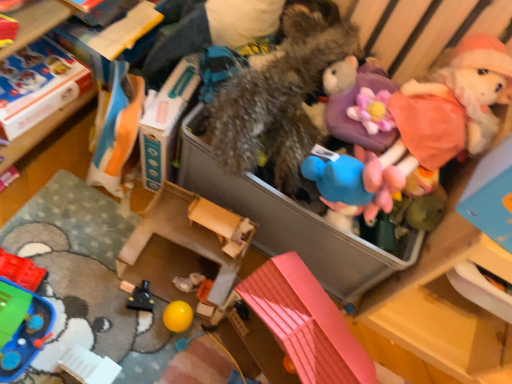
Question: Does orange fabric bag at upper left, the 3th toy viewed from the left, contain translucent plastic bricks at lower left, which is counted as the first toy, starting from the left?

Choices:
 (A) no
 (B) yes

Answer: (A)

Question: Is orange fabric bag at upper left, the 3th toy viewed from the left, thinner than translucent plastic bricks at lower left, which is counted as the first toy, starting from the left?

Choices:
 (A) no
 (B) yes

Answer: (A)

Question: Are orange fabric bag at upper left, the 3th toy viewed from the left, and translucent plastic bricks at lower left, which is counted as the first toy, starting from the left, beside each other?

Choices:
 (A) yes
 (B) no

Answer: (B)

Question: From a real-world perspective, is orange fabric bag at upper left, the 3th toy viewed from the left, over translucent plastic bricks at lower left, which is counted as the first toy, starting from the left?

Choices:
 (A) yes
 (B) no

Answer: (A)

Question: Is orange fabric bag at upper left, acting as the 6th toy starting from the right, to the right of translucent plastic bricks at lower left, which is counted as the first toy, starting from the left, from the viewer's perspective?

Choices:
 (A) yes
 (B) no

Answer: (A)

Question: In terms of width, does fuzzy fabric stuffed animal at center, positioned as the 4th toy in right-to-left order, look wider or thinner when compared to black plastic toy at lower left, acting as the fourth toy starting from the left?

Choices:
 (A) thin
 (B) wide

Answer: (B)

Question: From the image's perspective, is fuzzy fabric stuffed animal at center, positioned as the 4th toy in right-to-left order, above or below black plastic toy at lower left, acting as the fourth toy starting from the left?

Choices:
 (A) above
 (B) below

Answer: (A)

Question: From a real-world perspective, relative to black plastic toy at lower left, acting as the fourth toy starting from the left, is fuzzy fabric stuffed animal at center, the fifth toy in the left-to-right sequence, vertically above or below?

Choices:
 (A) below
 (B) above

Answer: (B)

Question: Visually, is fuzzy fabric stuffed animal at center, the fifth toy in the left-to-right sequence, positioned to the left or to the right of black plastic toy at lower left, acting as the fourth toy starting from the left?

Choices:
 (A) right
 (B) left

Answer: (A)

Question: Is fluffy plush doll at upper right, which appears as the first toy when viewed from the right, spatially inside green plastic boat at lower left, the second toy positioned from the left, or outside of it?

Choices:
 (A) outside
 (B) inside

Answer: (A)

Question: Is fluffy plush doll at upper right, which appears as the first toy when viewed from the right, bigger or smaller than green plastic boat at lower left, the second toy positioned from the left?

Choices:
 (A) small
 (B) big

Answer: (B)

Question: Looking at their shapes, would you say fluffy plush doll at upper right, the eighth toy in the left-to-right sequence, is wider or thinner than green plastic boat at lower left, the second toy positioned from the left?

Choices:
 (A) wide
 (B) thin

Answer: (A)

Question: Is fluffy plush doll at upper right, the eighth toy in the left-to-right sequence, taller or shorter than green plastic boat at lower left, the second toy positioned from the left?

Choices:
 (A) tall
 (B) short

Answer: (A)

Question: From the image's perspective, is orange fabric bag at upper left, the 3th toy viewed from the left, located above or below pink plastic toy house at lower center, which is the third toy from right to left?

Choices:
 (A) below
 (B) above

Answer: (B)

Question: Is orange fabric bag at upper left, acting as the 6th toy starting from the right, bigger or smaller than pink plastic toy house at lower center, which is the third toy from right to left?

Choices:
 (A) big
 (B) small

Answer: (B)